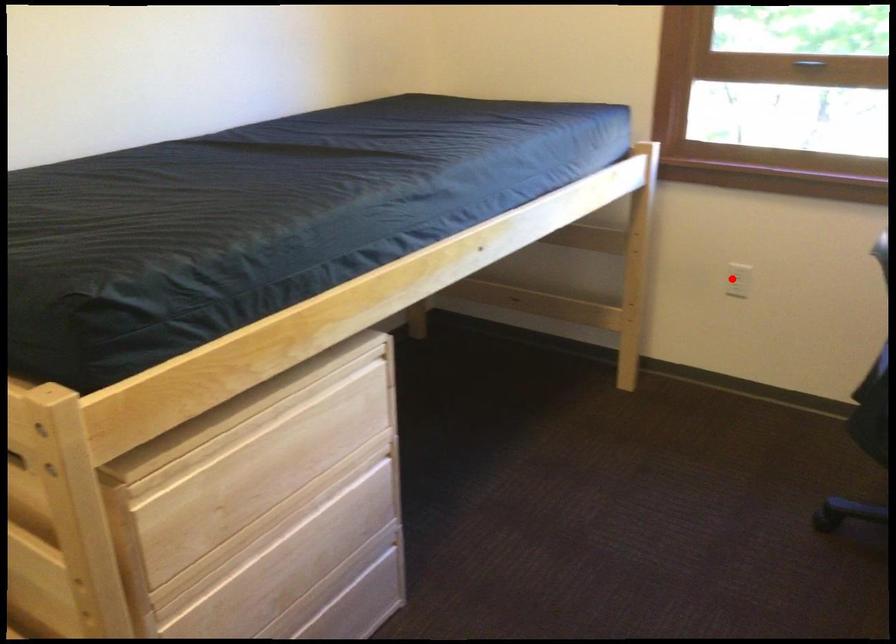
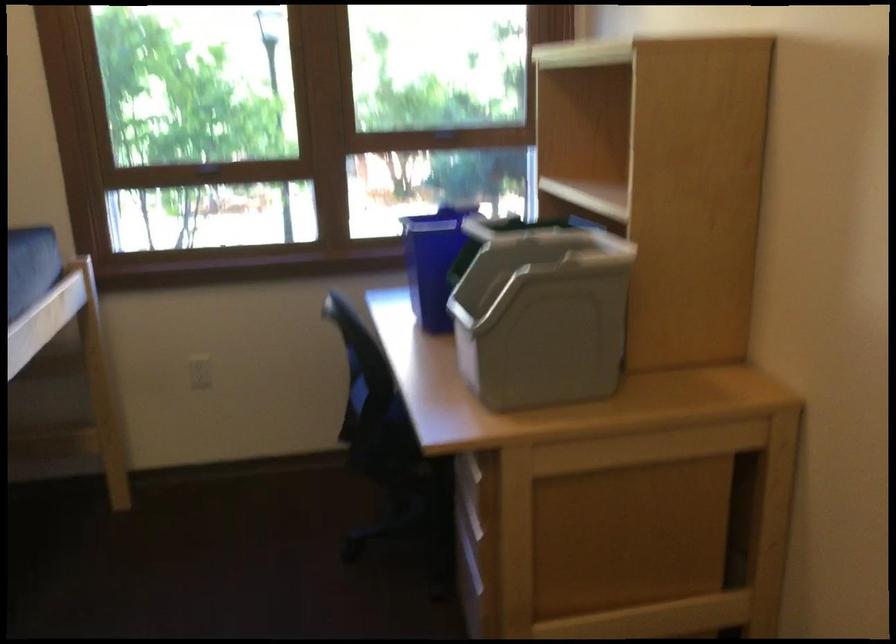
Locate, in the second image, the point that corresponds to the highlighted location in the first image.

(200, 372)